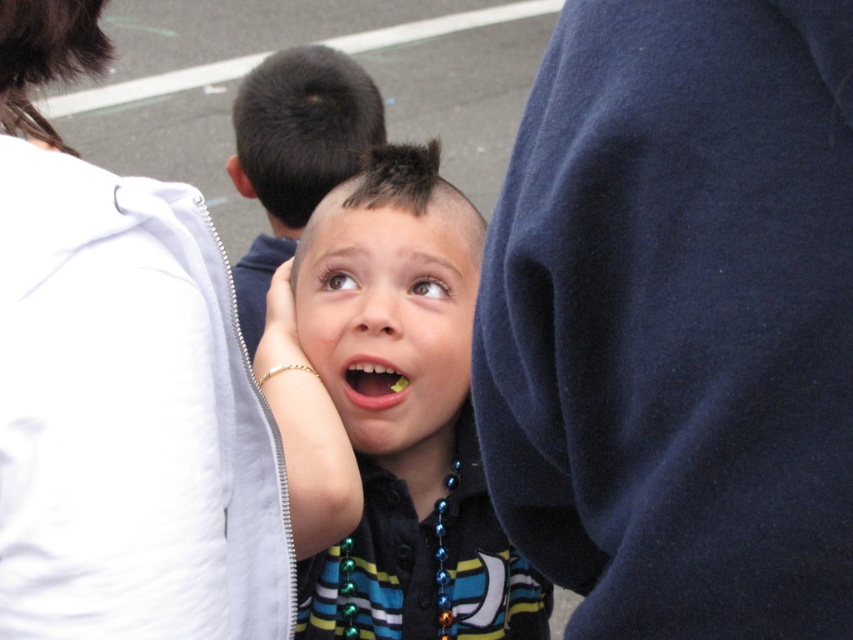
Which of these two, dark blue fleece at center or shiny black hair at center, stands shorter?

Standing shorter between the two is dark blue fleece at center.

I want to click on dark blue fleece at center, so click(x=677, y=320).

Find the location of a particular element. The width and height of the screenshot is (853, 640). dark blue fleece at center is located at coordinates (677, 320).

Which is behind, point (850, 605) or point (177, 307)?

Positioned behind is point (177, 307).

The image size is (853, 640). Identify the location of dark blue fleece at center. (677, 320).

Does smooth skin face at center appear on the right side of yellow plastic teeth at center?

Yes, smooth skin face at center is to the right of yellow plastic teeth at center.

Does smooth skin face at center come in front of yellow plastic teeth at center?

Yes, it is.

The image size is (853, 640). Find the location of `smooth skin face at center`. smooth skin face at center is located at coordinates (389, 317).